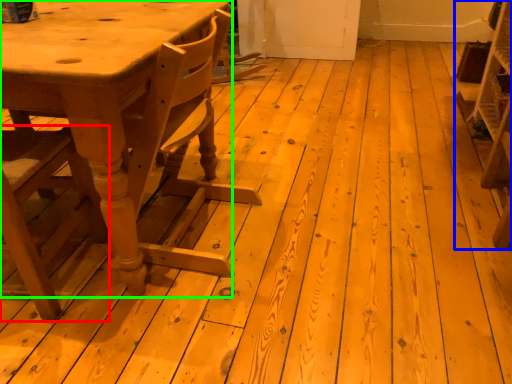
Question: Considering the real-world distances, which object is closest to chair (highlighted by a red box)? shelf (highlighted by a blue box) or table (highlighted by a green box).

Choices:
 (A) shelf
 (B) table

Answer: (B)